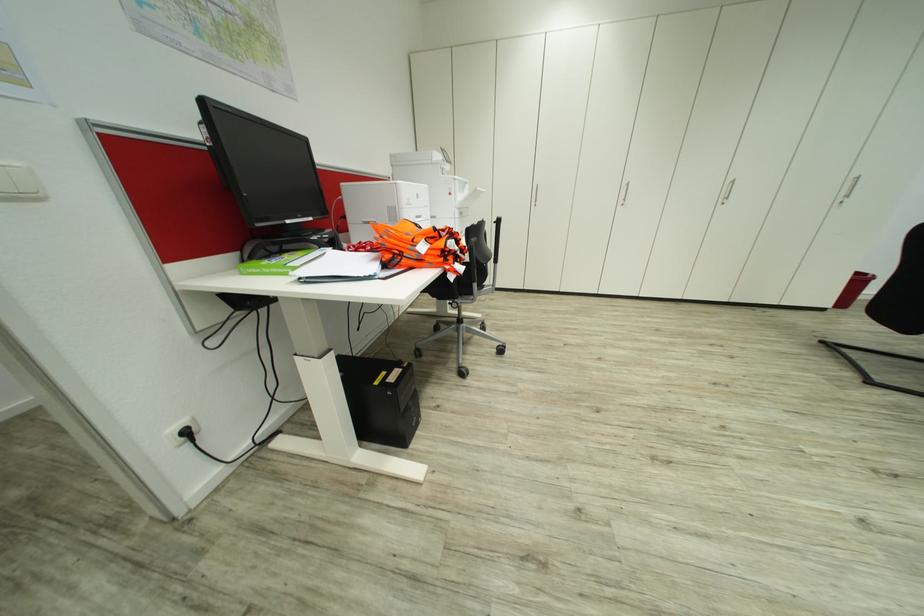
Where would you lift the black computer case? Please return your answer as a coordinate pair (x, y).

(381, 399)